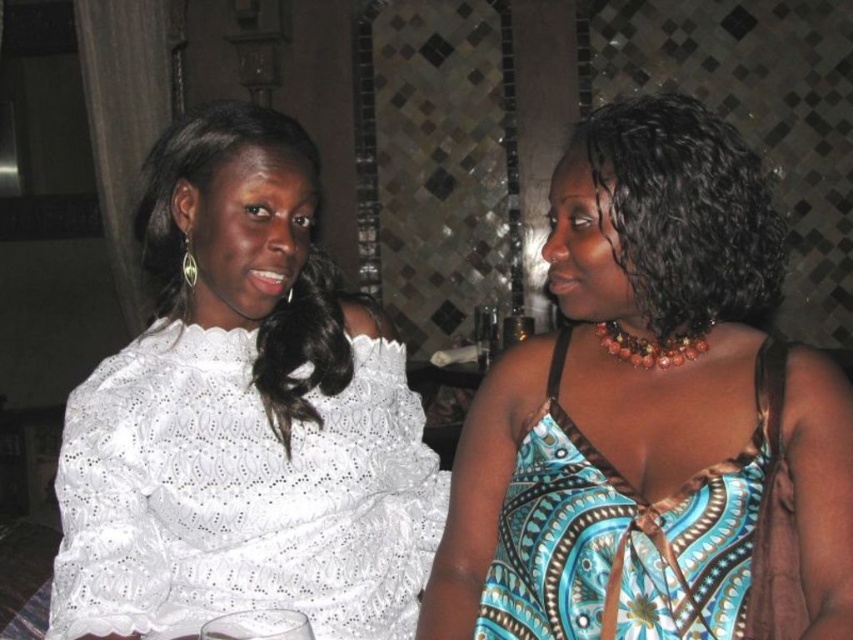
Question: Can you confirm if blue printed dress at center is wider than blue printed fabric dress at right?

Choices:
 (A) no
 (B) yes

Answer: (B)

Question: Which of the following is the closest to the observer?

Choices:
 (A) blue printed fabric dress at right
 (B) matte black hair at upper right

Answer: (A)

Question: Which object is farther from the camera taking this photo?

Choices:
 (A) white lace blouse at upper left
 (B) white lace dress at left
 (C) blue printed fabric dress at right
 (D) blue printed dress at center

Answer: (A)

Question: Does blue printed dress at center appear on the left side of blue printed fabric dress at right?

Choices:
 (A) no
 (B) yes

Answer: (A)

Question: Which object is the farthest from the blue printed fabric dress at right?

Choices:
 (A) white lace dress at left
 (B) matte black hair at upper right
 (C) blue printed dress at center
 (D) white lace blouse at upper left

Answer: (D)

Question: Is white lace dress at left to the right of blue printed fabric dress at right from the viewer's perspective?

Choices:
 (A) no
 (B) yes

Answer: (A)